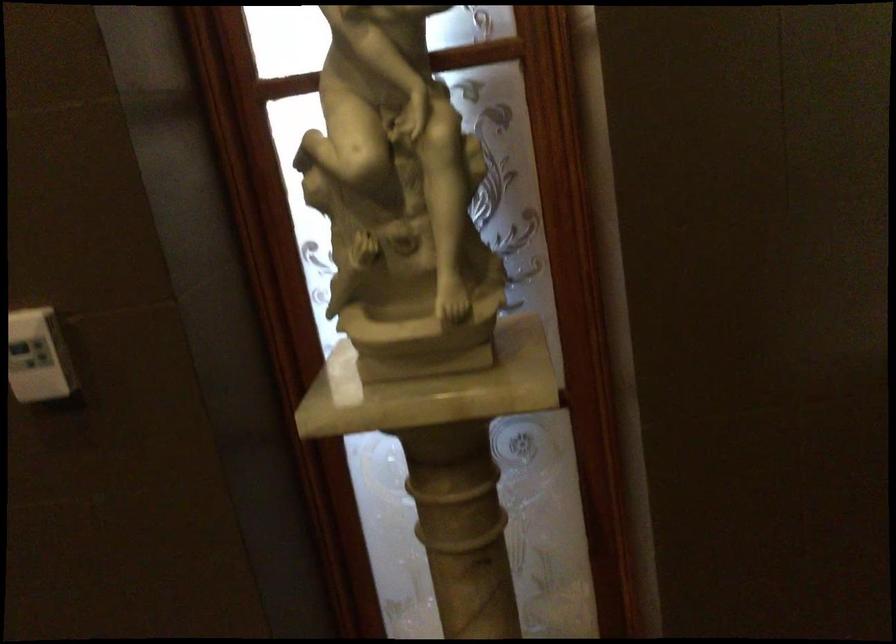
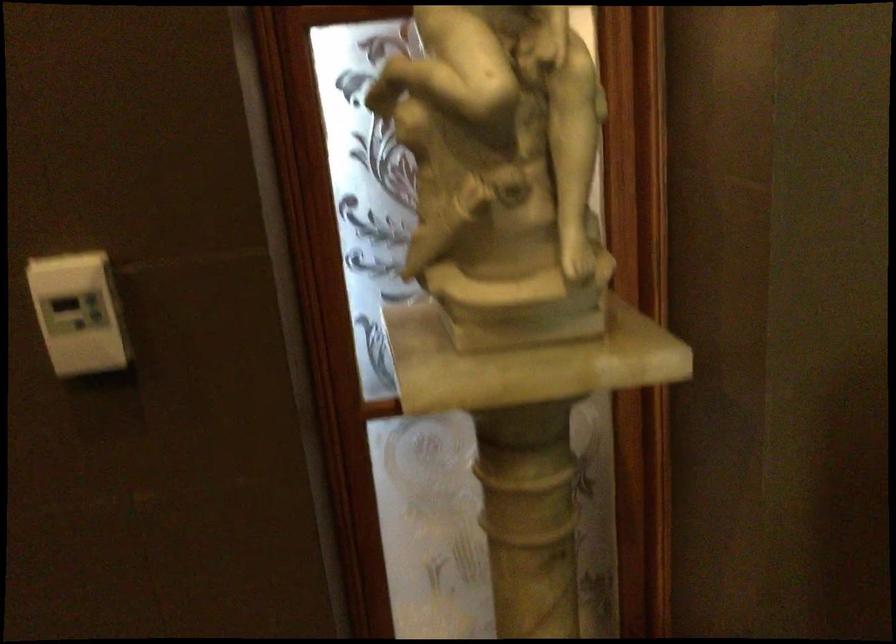
In a continuous first-person perspective shot, in which direction is the camera moving?

The cameraman walked toward left, forward.